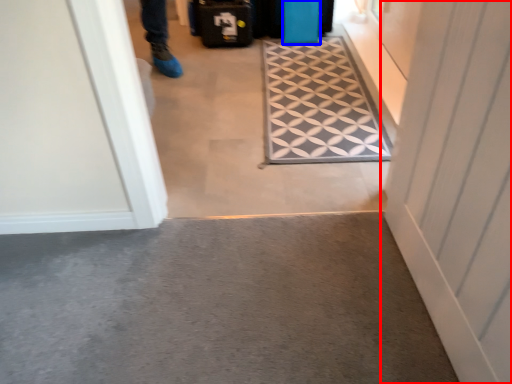
Question: Which object appears farthest to the camera in this image, door (highlighted by a red box) or luggage (highlighted by a blue box)?

Choices:
 (A) door
 (B) luggage

Answer: (B)